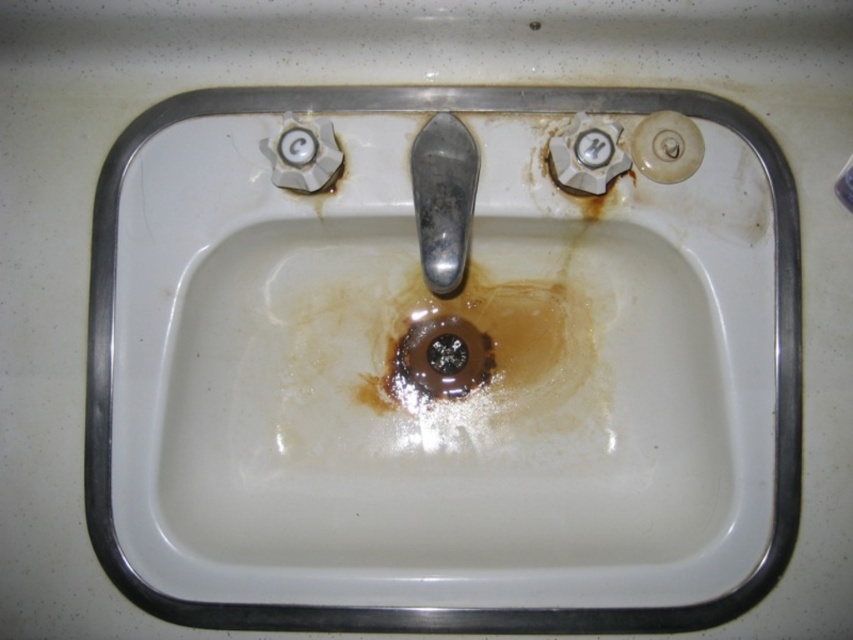
Question: In this image, where is white porcelain sink at center located relative to brown matte drain at center?

Choices:
 (A) above
 (B) below

Answer: (A)

Question: Can you confirm if shiny metallic faucet at center is bigger than brown matte drain at center?

Choices:
 (A) yes
 (B) no

Answer: (A)

Question: Is the position of shiny metallic faucet at center more distant than that of brown matte drain at center?

Choices:
 (A) yes
 (B) no

Answer: (B)

Question: Which point is closer to the camera taking this photo?

Choices:
 (A) (775, 243)
 (B) (434, 124)
 (C) (489, 349)

Answer: (B)

Question: Which object is farther from the camera taking this photo?

Choices:
 (A) white porcelain sink at center
 (B) shiny metallic faucet at center
 (C) brown matte drain at center

Answer: (C)

Question: Which of the following is the farthest from the observer?

Choices:
 (A) brown matte drain at center
 (B) white porcelain sink at center

Answer: (A)